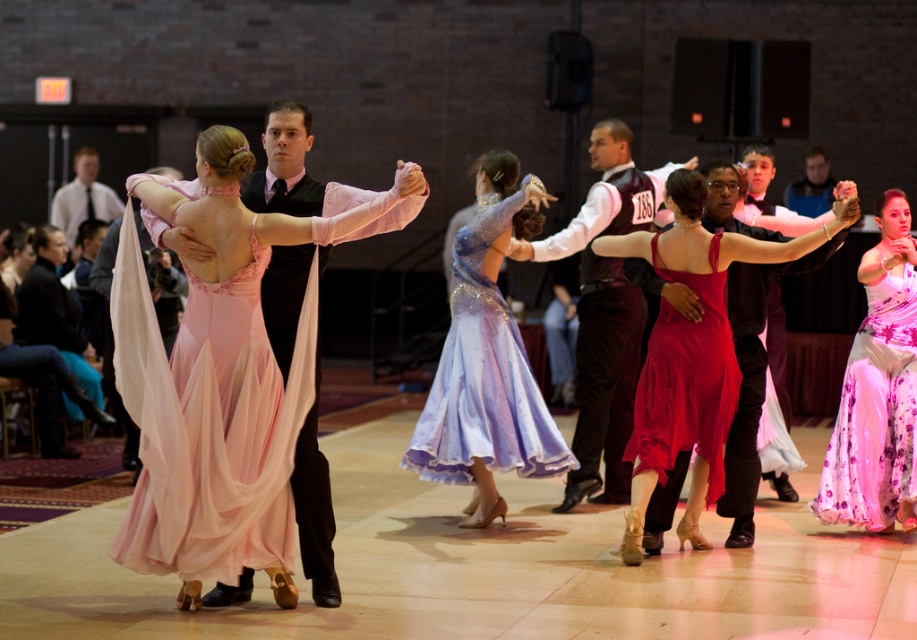
You are a photographer in the ballroom and want to capture a photo of the pink chiffon dress at center and the matte black vest at upper right. Which object will appear closer to the camera in the photo?

The pink chiffon dress at center will appear closer to the camera in the photo because it is positioned in front of the matte black vest at upper right.

In the scene shown: You are a photographer at the back of the ballroom and want to capture both the pink chiffon dress at center and the shiny red satin dress at center in a single shot. Which dress will appear larger in your photo?

The pink chiffon dress at center will appear larger in the photo because it is bigger than the shiny red satin dress at center.

In the ballroom dance scene, you notice two central items of clothing worn by the dancers. The shiny red dress at center and the maroon satin vest at center. Which one is positioned to the right side of the other?

The shiny red dress at center is positioned to the right of the maroon satin vest at center.